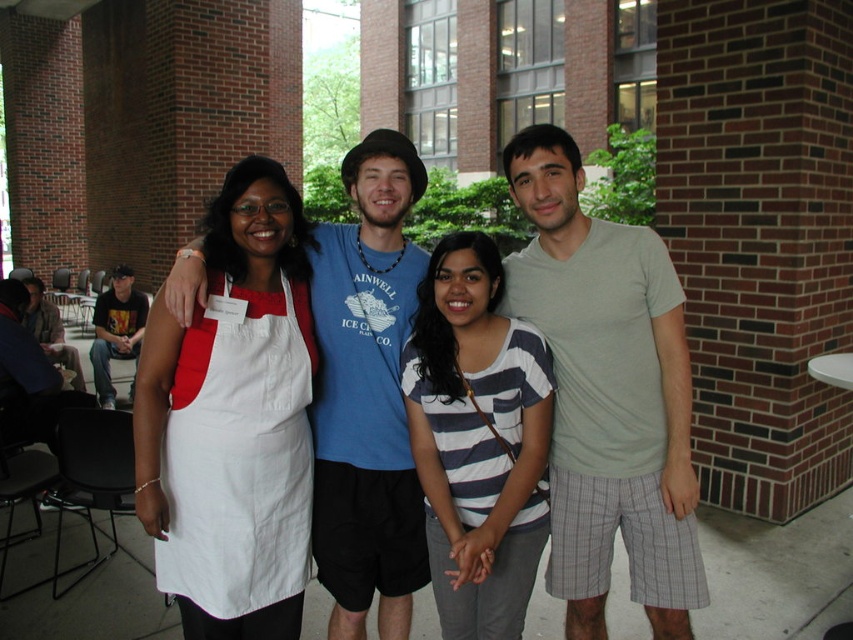
Question: Is white apron at center positioned behind blue cotton t-shirt at center?

Choices:
 (A) yes
 (B) no

Answer: (B)

Question: Among these points, which one is nearest to the camera?

Choices:
 (A) (33, 320)
 (B) (683, 620)

Answer: (B)

Question: Which object appears closest to the camera in this image?

Choices:
 (A) dark gray t-shirt at left
 (B) white cotton apron at left
 (C) blue cotton t-shirt at center
 (D) white apron at center

Answer: (B)

Question: Which of these objects is positioned closest to the white apron at center?

Choices:
 (A) dark gray t-shirt at left
 (B) light gray cotton t-shirt at center

Answer: (B)

Question: Is blue cotton t-shirt at center thinner than dark gray t-shirt at left?

Choices:
 (A) no
 (B) yes

Answer: (B)

Question: Is dark gray t-shirt at left further to the viewer compared to blue t-shirt at left?

Choices:
 (A) no
 (B) yes

Answer: (B)